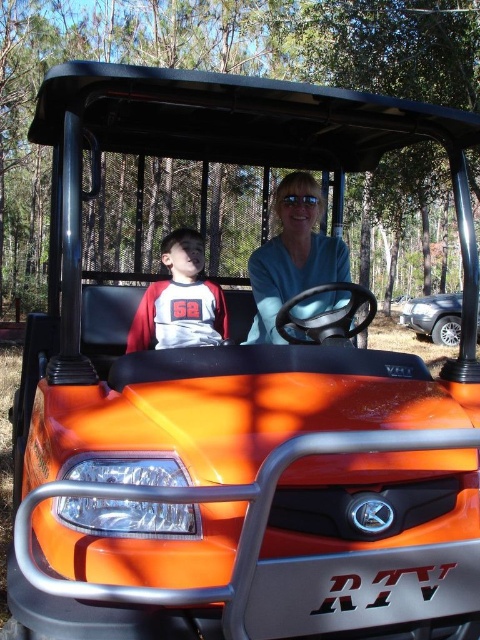
You are a photographer standing in front of the orange utility vehicle. You notice the blue matte shirt at center and the red jersey at center. Which clothing item appears bigger in the photo?

The blue matte shirt at center appears larger in size than the red jersey at center in the photo.